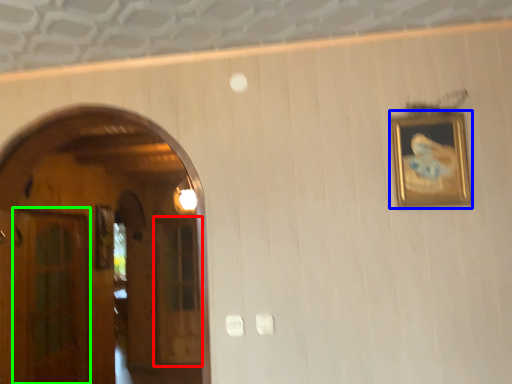
Question: Estimate the real-world distances between objects in this image. Which object is farther from glass door (highlighted by a red box), picture frame (highlighted by a blue box) or glass door (highlighted by a green box)?

Choices:
 (A) picture frame
 (B) glass door

Answer: (A)